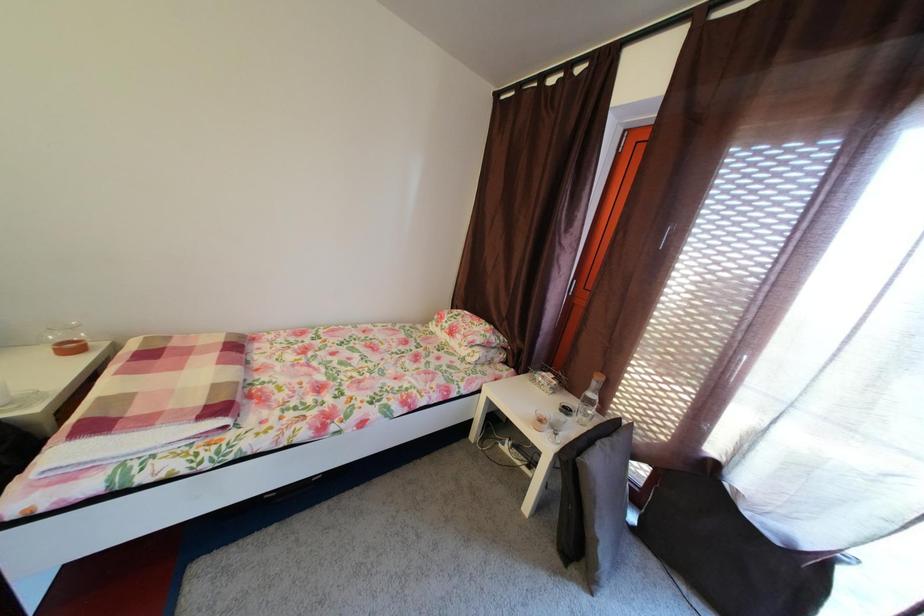
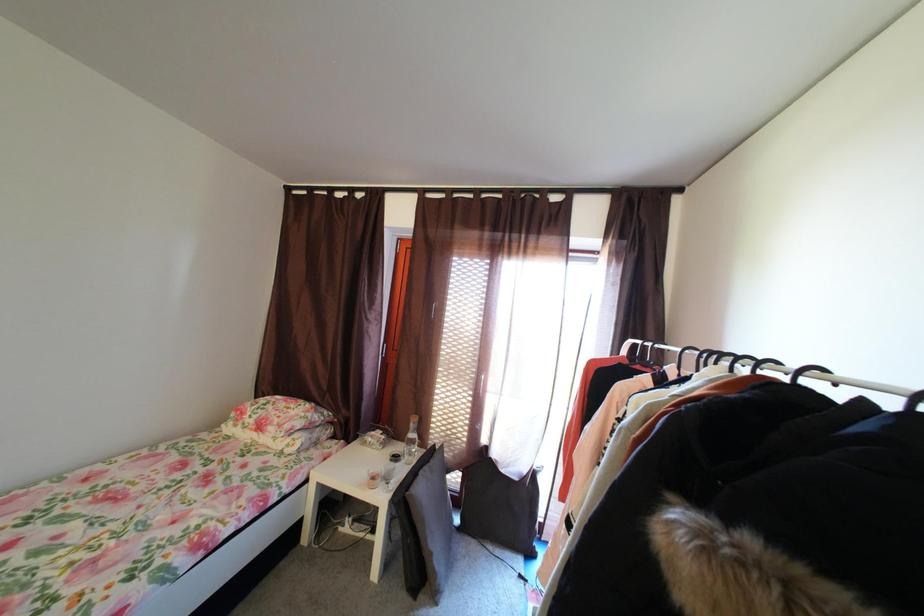
Question: Based on the continuous images, in which direction is the camera rotating? Reply with the corresponding letter.

Choices:
 (A) Left
 (B) Right
 (C) Up
 (D) Down

Answer: (B)